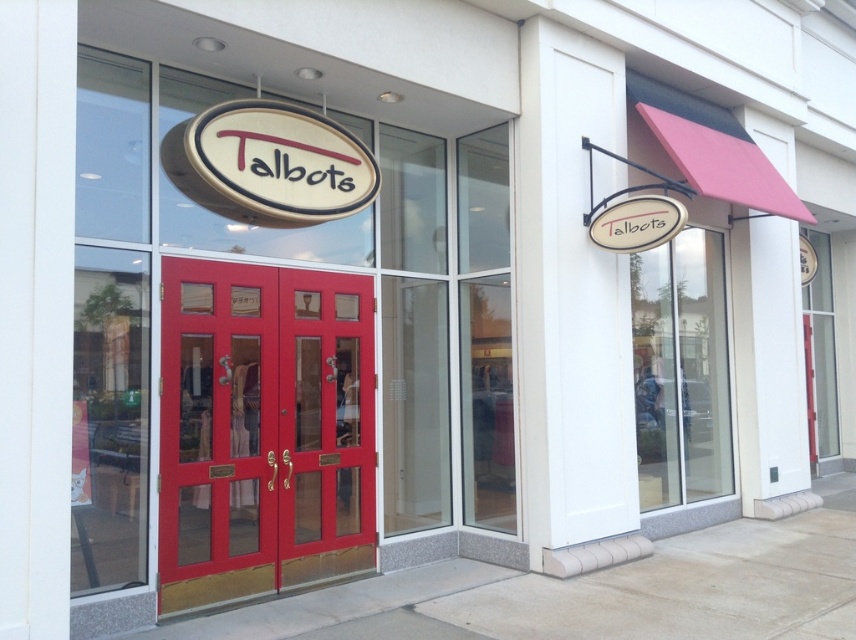
Question: Is transparent glass door at center smaller than matte white oval sign at center?

Choices:
 (A) yes
 (B) no

Answer: (B)

Question: Which object appears closest to the camera in this image?

Choices:
 (A) matte wood door at center
 (B) matte glass door at center

Answer: (A)

Question: In this image, where is matte wood door at center located relative to matte white oval sign at center?

Choices:
 (A) right
 (B) left

Answer: (B)

Question: Can you confirm if matte glass door at center is positioned to the right of transparent glass door at center?

Choices:
 (A) yes
 (B) no

Answer: (B)

Question: Considering the real-world distances, which object is closest to the matte white oval sign at center?

Choices:
 (A) matte wood door at center
 (B) white wood sign at upper right
 (C) transparent glass door at center
 (D) matte glass door at center

Answer: (A)

Question: Among these objects, which one is nearest to the camera?

Choices:
 (A) matte glass door at center
 (B) matte white oval sign at center
 (C) matte wood door at center
 (D) transparent glass door at center

Answer: (C)